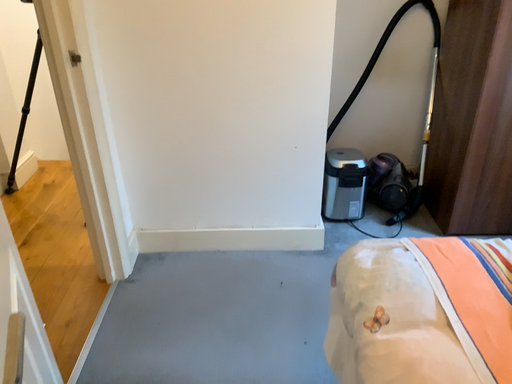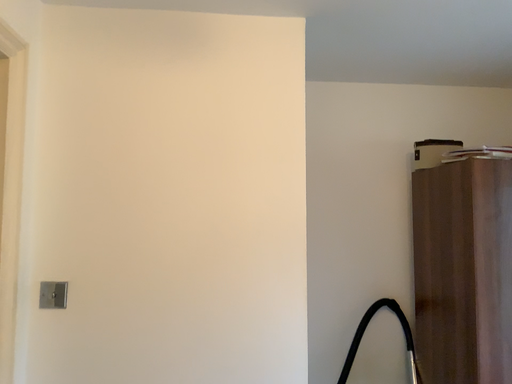
Question: Which way did the camera rotate in the video?

Choices:
 (A) rotated upward
 (B) rotated downward

Answer: (A)